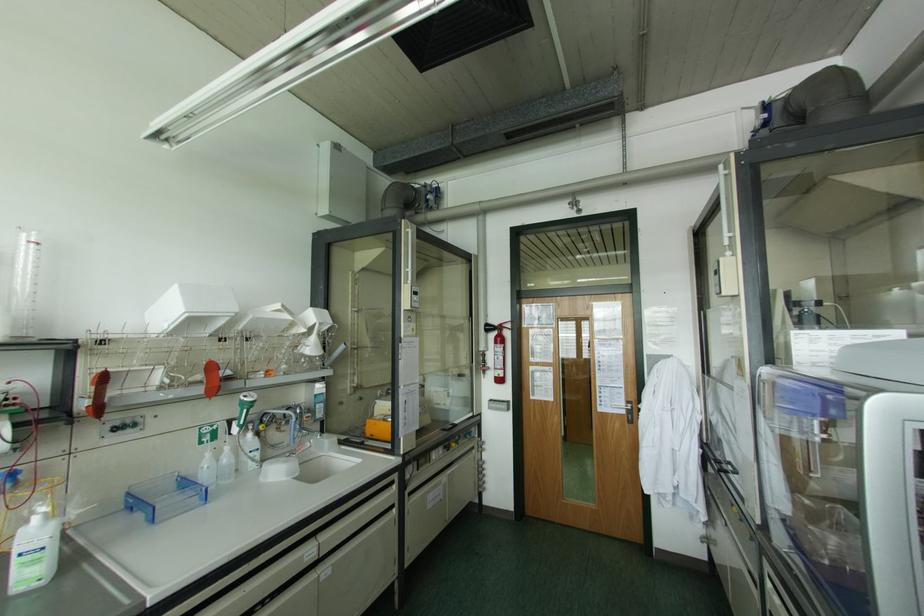
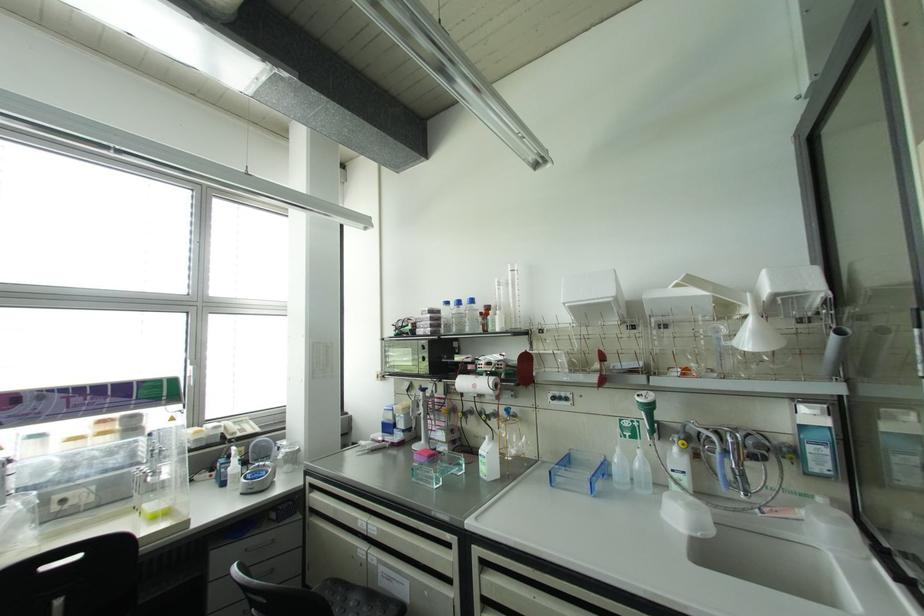
Where in the second image is the point corresponding to pixel 241 426 from the first image?

(650, 432)